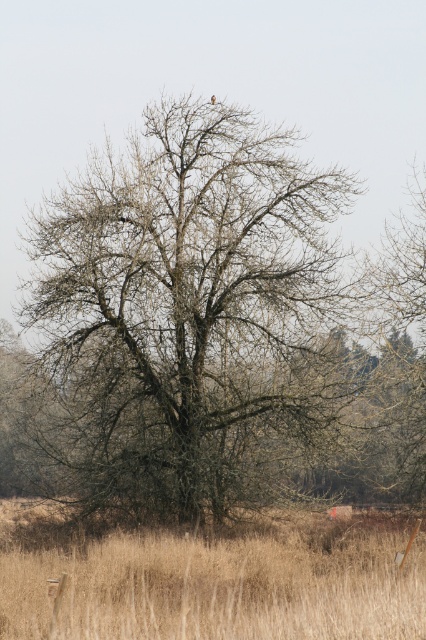
You are a bird seeking shelter from the rain. You spot the image and see the bare branches at center and the brown dry grass at lower center. Which location would provide better protection from the rain?

The bare branches at center would provide better protection from the rain as they are positioned over the brown dry grass at lower center, offering shelter from above.

You are a bird looking for a place to land. You see the bare branches at center and the brown dry grass at lower center. Which one is closer to your left side?

The bare branches at center is to the left of brown dry grass at lower center, so the bare branches at center is closer to your left side.